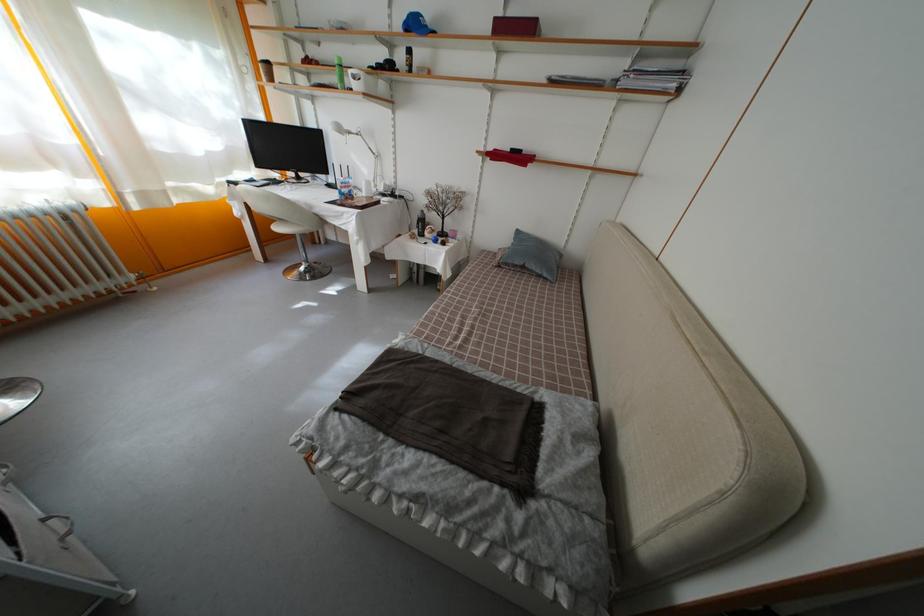
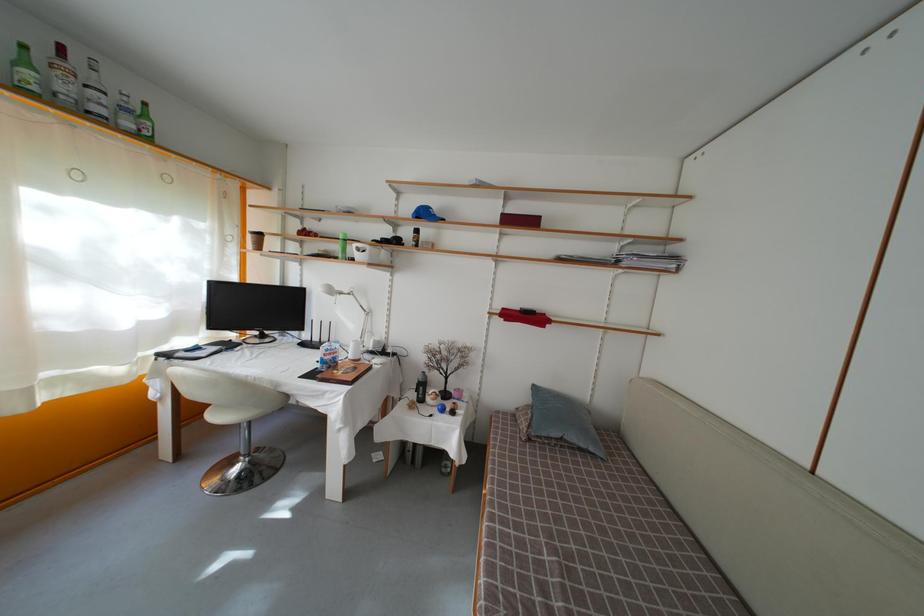
Where in the second image is the point corresponding to (x=284, y=235) from the first image?

(221, 422)